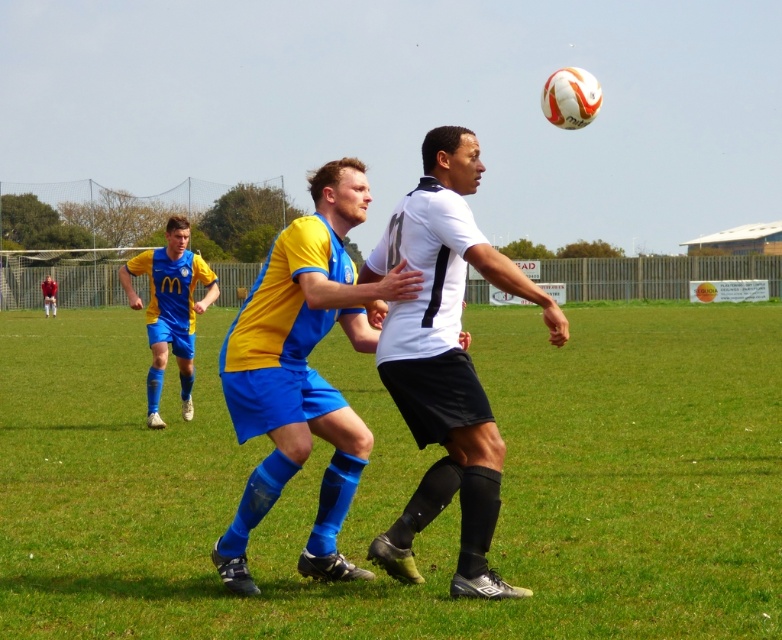
Can you confirm if green grass at center is smaller than yellow jersey at center?

No.

Is green grass at center above yellow jersey at center?

Actually, green grass at center is below yellow jersey at center.

Does point (619, 420) lie behind point (153, 378)?

Yes.

Identify the location of green grass at center. The width and height of the screenshot is (782, 640). (404, 484).

Can you confirm if yellow jersey at center is smaller than red fabric shirt at center?

Actually, yellow jersey at center might be larger than red fabric shirt at center.

You are a GUI agent. You are given a task and a screenshot of the screen. Output one action in this format:
    pyautogui.click(x=<x>, y=<y>)
    Task: Click on the yellow jersey at center
    
    Given the screenshot: What is the action you would take?
    pyautogui.click(x=170, y=308)

You are a GUI agent. You are given a task and a screenshot of the screen. Output one action in this format:
    pyautogui.click(x=<x>, y=<y>)
    Task: Click on the yellow jersey at center
    The image size is (782, 640).
    Given the screenshot: What is the action you would take?
    pyautogui.click(x=170, y=308)

You are a GUI agent. You are given a task and a screenshot of the screen. Output one action in this format:
    pyautogui.click(x=<x>, y=<y>)
    Task: Click on the yellow jersey at center
    This screenshot has width=782, height=640.
    Given the screenshot: What is the action you would take?
    pyautogui.click(x=170, y=308)

Who is lower down, yellow/blue jersey at center or red fabric shirt at center?

red fabric shirt at center

Is yellow/blue jersey at center bigger than red fabric shirt at center?

Actually, yellow/blue jersey at center might be smaller than red fabric shirt at center.

Does point (325, 554) come closer to viewer compared to point (45, 307)?

Yes, point (325, 554) is in front of point (45, 307).

This screenshot has height=640, width=782. I want to click on yellow/blue jersey at center, so click(x=302, y=371).